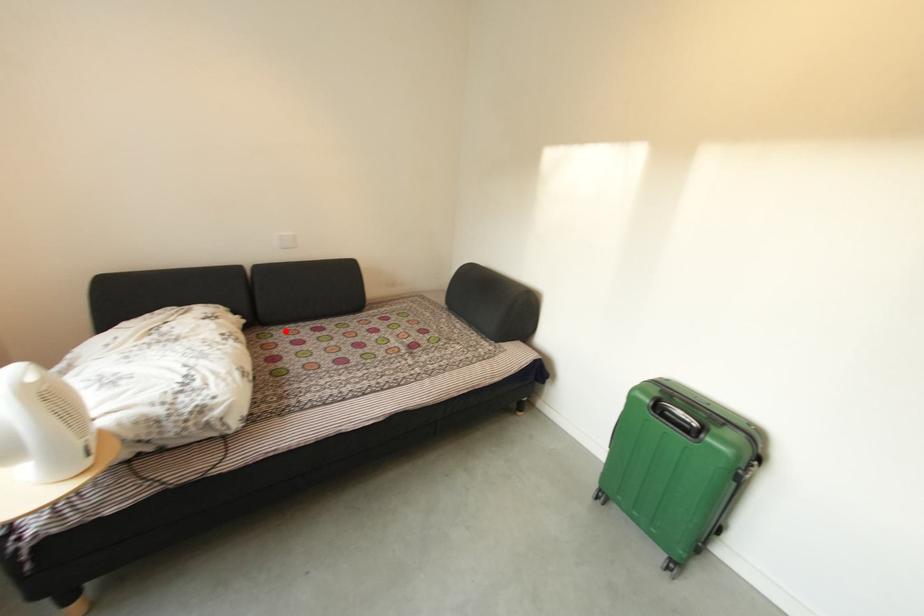
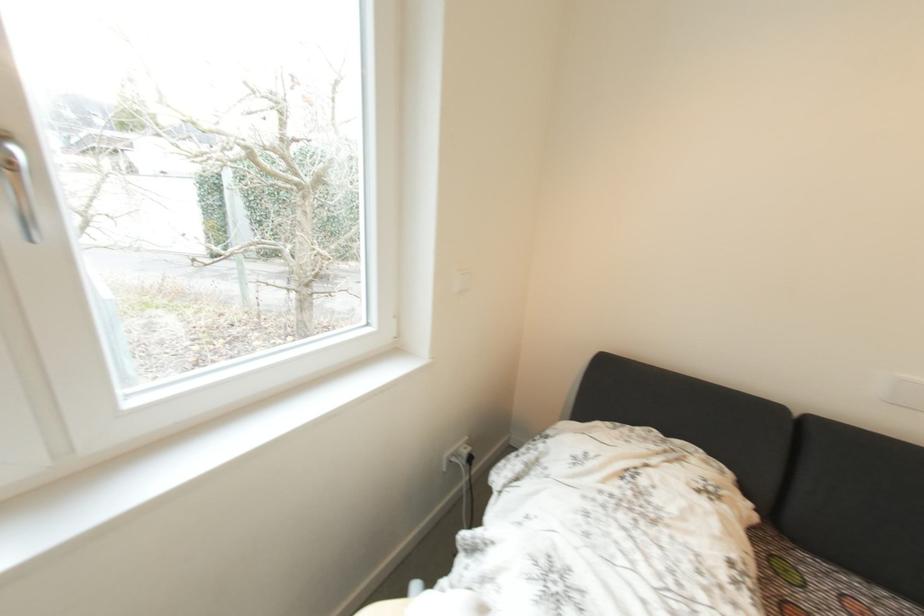
Where in the second image is the point corresponding to the highlighted location from the first image?

(820, 561)